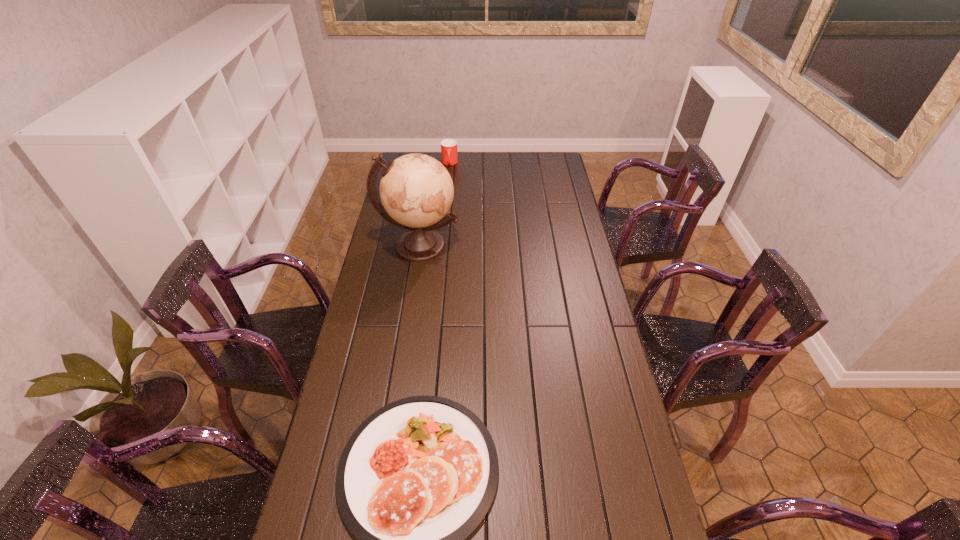
Identify the location of vacant space at the right edge of the desktop. The height and width of the screenshot is (540, 960). (583, 239).

What are the coordinates of `free point at the far right corner` in the screenshot? It's located at (538, 166).

Image resolution: width=960 pixels, height=540 pixels. I want to click on object that is the second closest to the globe, so click(417, 477).

Identify which object is located as the second nearest to the second shortest object. Please provide its 2D coordinates. Your answer should be formatted as a tuple, i.e. [(x, y)], where the tuple contains the x and y coordinates of a point satisfying the conditions above.

[(417, 477)]